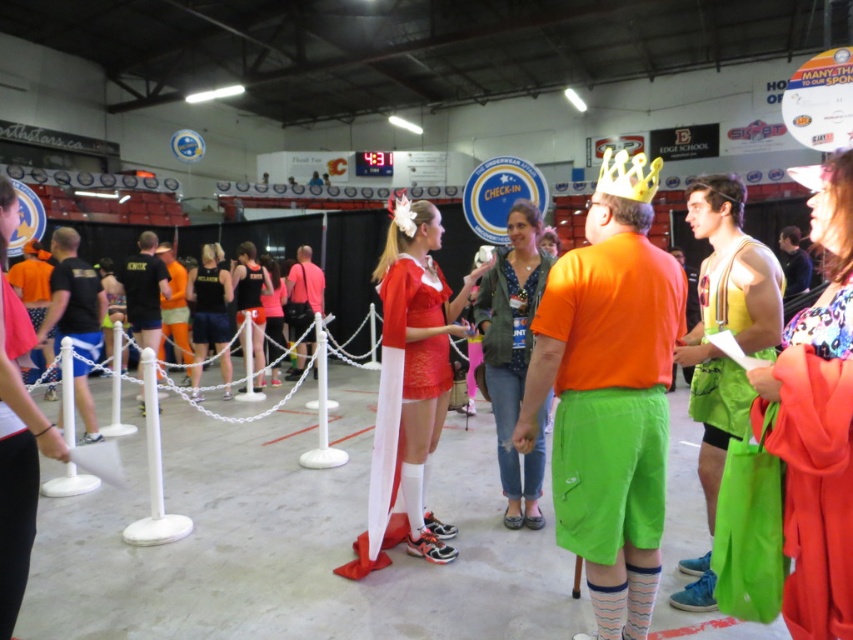
Question: Which point is farther to the camera?

Choices:
 (A) matte red dress at center
 (B) denim jacket at center
 (C) black t-shirt at left

Answer: (C)

Question: Can you confirm if yellow shiny crown at upper center is smaller than orange fabric shorts at center?

Choices:
 (A) yes
 (B) no

Answer: (A)

Question: Which is nearer to the matte red dress at center?

Choices:
 (A) black mesh t-shirt at left
 (B) yellow shiny crown at upper center
 (C) orange fabric shorts at left

Answer: (B)

Question: Is matte red dress at center thinner than denim jacket at center?

Choices:
 (A) yes
 (B) no

Answer: (B)

Question: Is black mesh t-shirt at left to the left of dark blue jersey at center from the viewer's perspective?

Choices:
 (A) yes
 (B) no

Answer: (A)

Question: Which point is farther to the camera?

Choices:
 (A) black mesh t-shirt at left
 (B) floral fabric dress at right

Answer: (A)